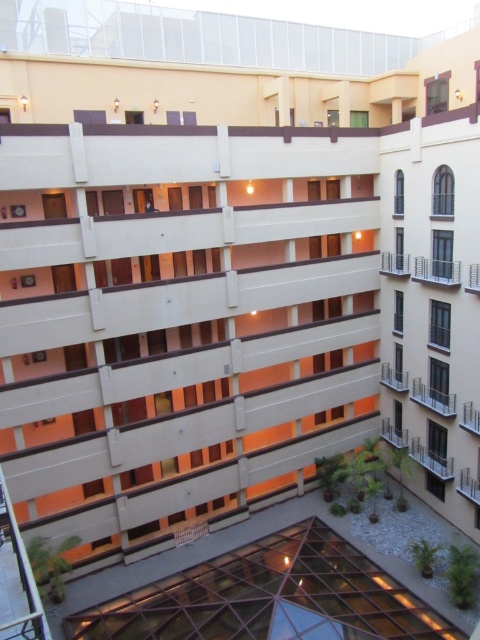
Does transparent glass atrium at lower center lie behind matte white balcony at center-right?

That is False.

Does point (226, 577) lie in front of point (392, 388)?

Yes, point (226, 577) is closer to viewer.

This screenshot has width=480, height=640. I want to click on transparent glass atrium at lower center, so click(x=268, y=595).